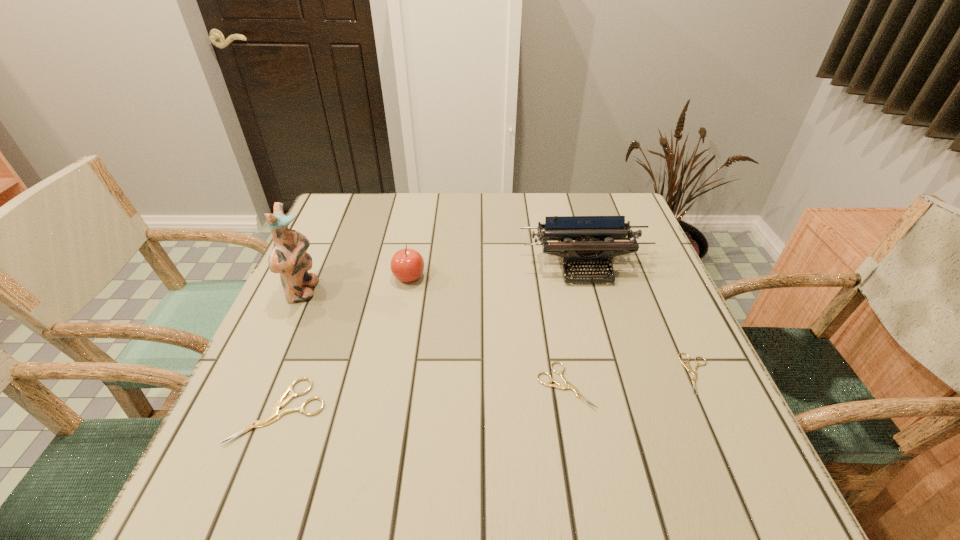
You are a GUI agent. You are given a task and a screenshot of the screen. Output one action in this format:
    pyautogui.click(x=<x>, y=<y>)
    Task: Click on the vacant space that satisfies the following two spatial constraints: 1. on the back side of the third tallest object; 2. on the right side of the fourth tallest object
    
    Given the screenshot: What is the action you would take?
    pyautogui.click(x=331, y=277)

The width and height of the screenshot is (960, 540). In order to click on vacant space that satisfies the following two spatial constraints: 1. on the front-facing side of the tallest object; 2. on the left side of the shortest object in this screenshot , I will do `click(267, 374)`.

At what (x,y) coordinates should I click in order to perform the action: click on free space that satisfies the following two spatial constraints: 1. on the front-facing side of the tallest object; 2. on the back side of the second shears from left to right. Please return your answer as a coordinate pair (x, y). Looking at the image, I should click on tap(262, 386).

Identify the location of free spot that satisfies the following two spatial constraints: 1. on the typing side of the rightmost shears; 2. on the right side of the typewriter. The width and height of the screenshot is (960, 540). (613, 374).

At what (x,y) coordinates should I click in order to perform the action: click on vacant area that satisfies the following two spatial constraints: 1. on the front-facing side of the rightmost shears; 2. on the right side of the tallest object. Please return your answer as a coordinate pair (x, y). The width and height of the screenshot is (960, 540). Looking at the image, I should click on (267, 374).